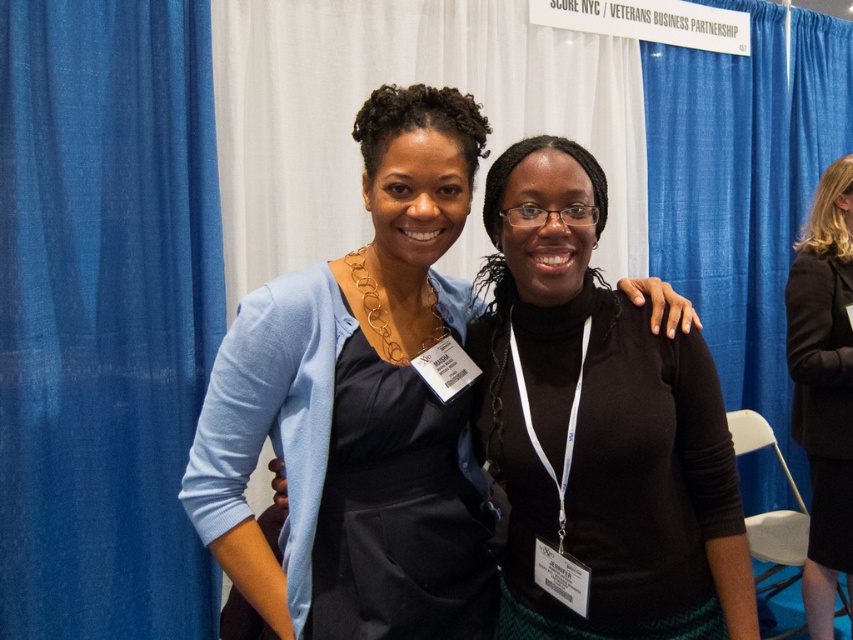
Measure the distance between point (169, 477) and camera.

Point (169, 477) is 7.93 feet away from camera.

Does blue fabric curtain at left have a greater width compared to dark brown wool coat at right?

Indeed, blue fabric curtain at left has a greater width compared to dark brown wool coat at right.

Between point (128, 381) and point (807, 605), which one is positioned in front?

Positioned in front is point (128, 381).

In order to click on blue fabric curtain at left in this screenshot , I will do `click(103, 314)`.

Which of these two, blue fabric curtain at left or matte blue cardigan at center, stands taller?

blue fabric curtain at left is taller.

Which is above, blue fabric curtain at left or matte blue cardigan at center?

blue fabric curtain at left is higher up.

This screenshot has width=853, height=640. What do you see at coordinates (103, 314) in the screenshot?
I see `blue fabric curtain at left` at bounding box center [103, 314].

Identify the location of blue fabric curtain at left. (103, 314).

Is matte blue cardigan at center below dark brown wool coat at right?

Actually, matte blue cardigan at center is above dark brown wool coat at right.

Looking at this image, who is more distant from viewer, (334, 515) or (796, 412)?

Positioned behind is point (796, 412).

Where is `matte blue cardigan at center`? The width and height of the screenshot is (853, 640). matte blue cardigan at center is located at coordinates (358, 406).